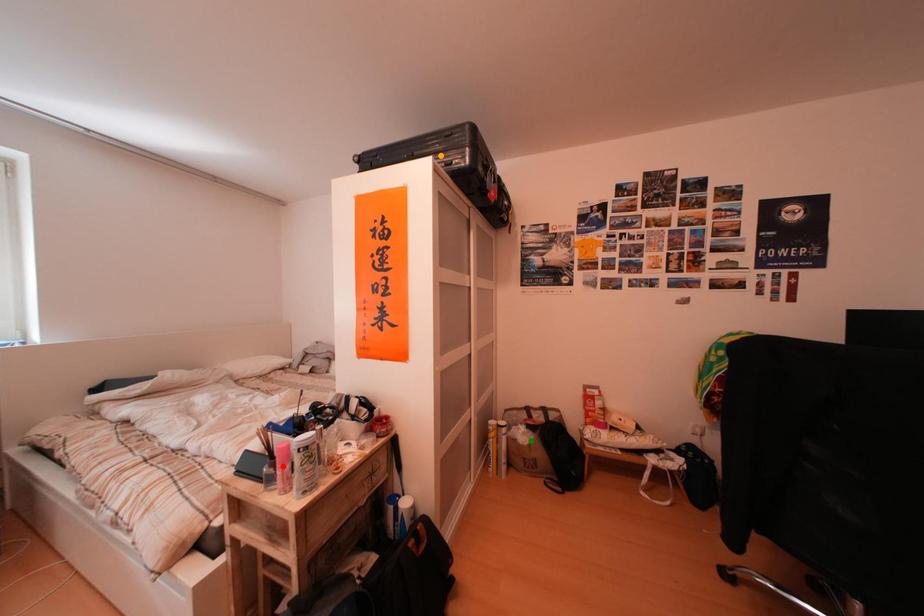
Order these from nearest to farthest:
1. green point
2. orange point
3. red point

red point → orange point → green point